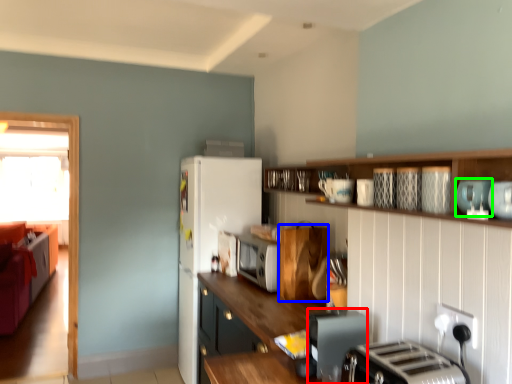
Question: Which object is positioned farthest from appliance (highlighted by a red box)? Select from cabinetry (highlighted by a blue box) and appliance (highlighted by a green box).

Choices:
 (A) cabinetry
 (B) appliance

Answer: (A)